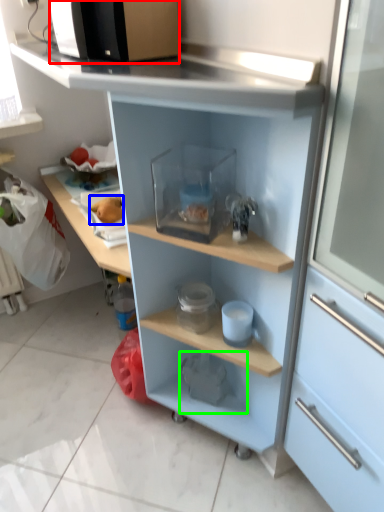
Question: Which is nearer to the microwave oven (highlighted by a red box)? food (highlighted by a blue box) or appliance (highlighted by a green box).

Choices:
 (A) food
 (B) appliance

Answer: (A)